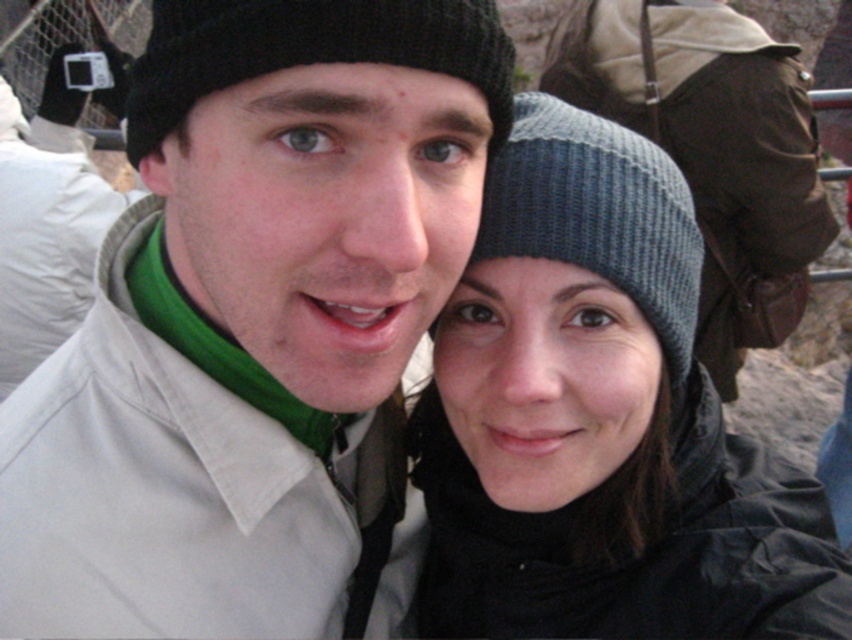
You are observing the scene and notice the gray knit beanie at upper center. Where exactly is it positioned in the image?

The gray knit beanie at upper center is located at point 0.233 on the horizontal axis and 0.837 on the vertical axis.

You are a photographer trying to capture a portrait of the two people in the scene. You want to ensure that both the knitted wool beanie at center and the black knit hat at upper center are clearly visible in the frame. Based on their sizes, which one might require you to adjust your camera angle to avoid being too dominant in the shot?

The knitted wool beanie at center has a greater height compared to the black knit hat at upper center, so it might require adjusting the camera angle to prevent it from overshadowing the other elements in the frame.